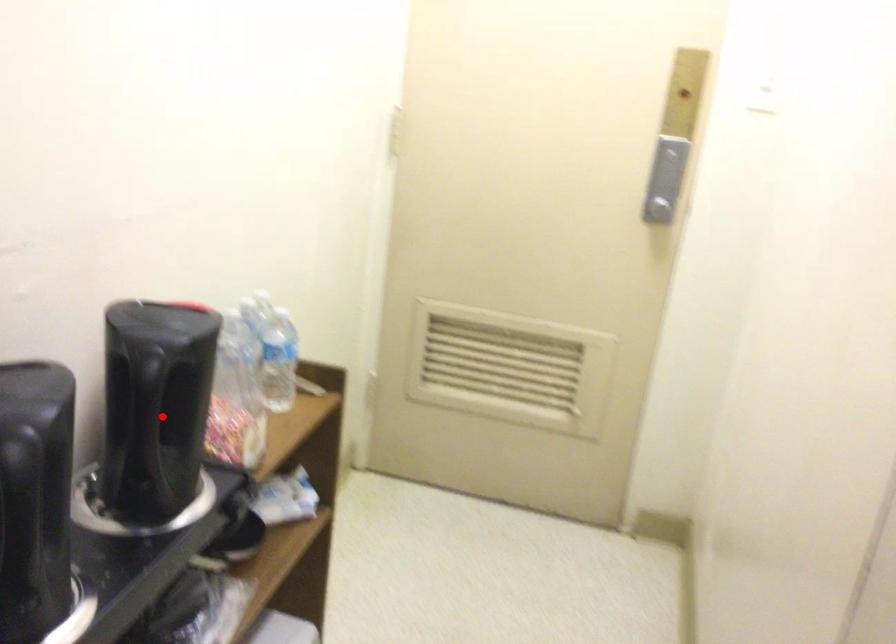
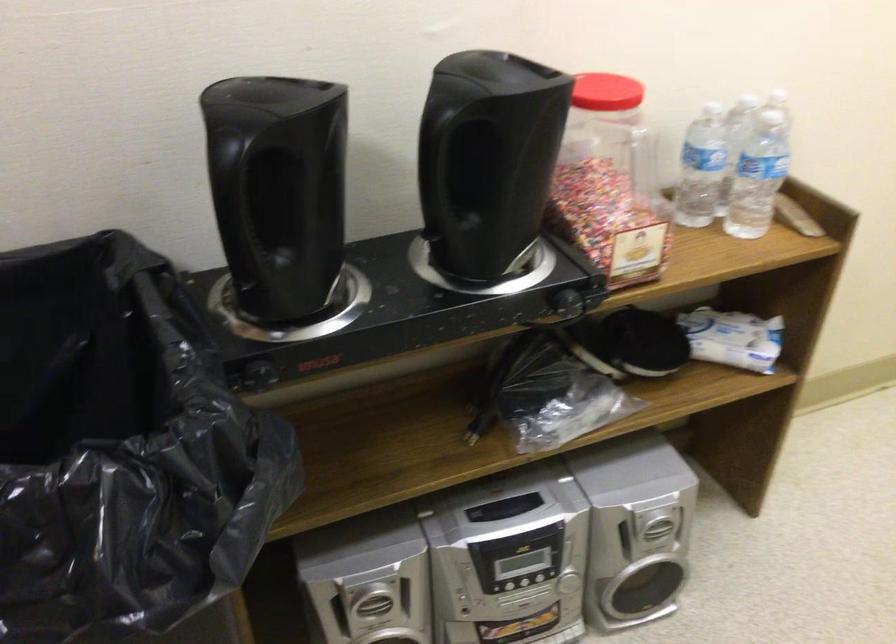
Find the pixel in the second image that matches the highlighted location in the first image.

(435, 169)